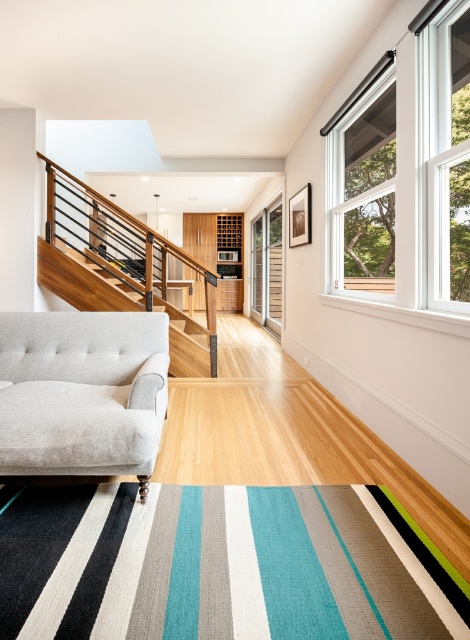
Does light gray fabric couch at lower left have a greater height compared to wooden balustrade at upper left?

No, light gray fabric couch at lower left is not taller than wooden balustrade at upper left.

Does light gray fabric couch at lower left appear under wooden balustrade at upper left?

Yes.

The height and width of the screenshot is (640, 470). What are the coordinates of `light gray fabric couch at lower left` in the screenshot? It's located at (81, 392).

Where is `light gray fabric couch at lower left`? light gray fabric couch at lower left is located at coordinates (81, 392).

Does white wood window at upper right have a larger size compared to wooden balustrade at upper left?

No.

Which is more to the right, white wood window at upper right or wooden balustrade at upper left?

Positioned to the right is white wood window at upper right.

Between point (416, 72) and point (180, 353), which one is positioned behind?

Positioned behind is point (180, 353).

Image resolution: width=470 pixels, height=640 pixels. In order to click on white wood window at upper right in this screenshot , I will do `click(404, 172)`.

Is white wood window at upper right wider than light gray fabric couch at lower left?

Incorrect, white wood window at upper right's width does not surpass light gray fabric couch at lower left's.

Does point (352, 108) lie behind point (55, 404)?

Yes.

Which is behind, point (355, 259) or point (12, 461)?

Point (355, 259)

Locate an element on the screen. white wood window at upper right is located at coordinates (404, 172).